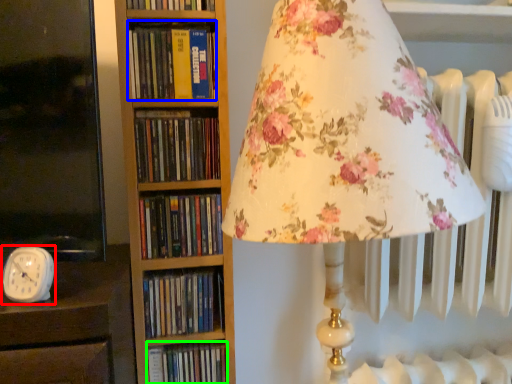
Question: Which is nearer to the clock (highlighted by a red box)? book (highlighted by a blue box) or book (highlighted by a green box).

Choices:
 (A) book
 (B) book

Answer: (B)